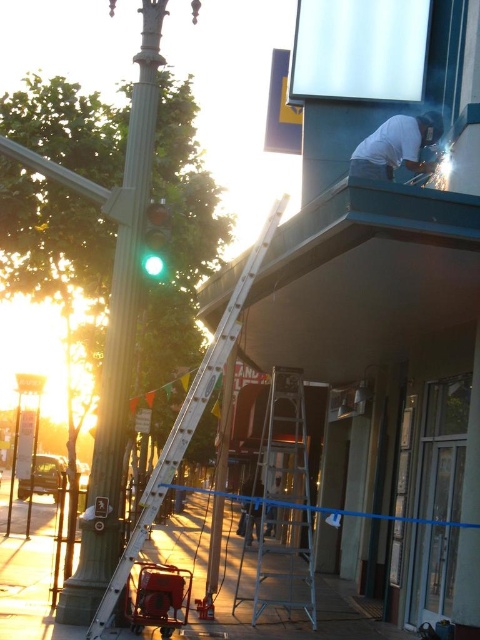
You are a delivery person trying to reach a package stuck on the lamppost. You have two ladders available, the silver metallic ladder at center and the white aluminum ladder at center. Which ladder should you choose to ensure you can reach the package?

The silver metallic ladder at center is wider than the white aluminum ladder at center, so you should choose the silver metallic ladder at center to ensure stability and reach the package safely.

You are a delivery person trying to reach the top of the white aluminum ladder at center to retrieve a package stuck there. However, the green polished metal pole at left is blocking your path. Can you walk around the pole to access the ladder?

The green polished metal pole at left is positioned over the white aluminum ladder at center, meaning the ladder is beneath the pole. Since the pole is blocking the path, you cannot walk around it to access the ladder directly. You may need to move the ladder or find an alternative route.

You are a delivery person with a 1.5 meter wide cart. You need to maneuver your cart through the space between the green polished metal pole at left and the white aluminum ladder at center. Can your cart fit through the gap?

The distance between the green polished metal pole at left and the white aluminum ladder at center is 1.89 meters. Since your cart is 1.5 meters wide, it can fit through the gap as there is enough space.